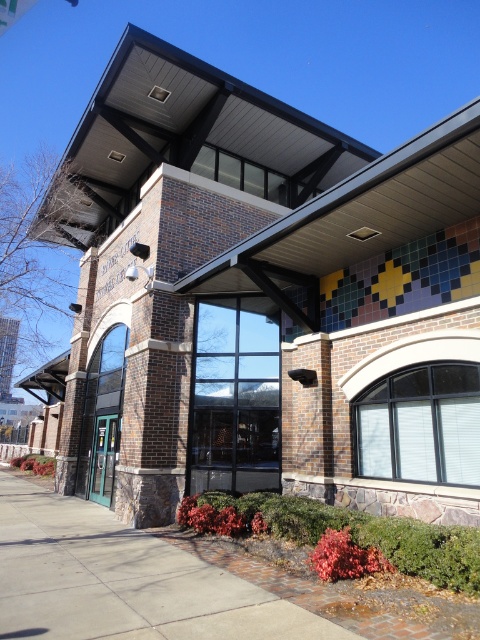
Is gray concrete sidewalk at lower left closer to camera compared to matte glass door at center?

Yes, gray concrete sidewalk at lower left is closer to the viewer.

Measure the distance between gray concrete sidewalk at lower left and camera.

The distance of gray concrete sidewalk at lower left from camera is 12.79 feet.

The height and width of the screenshot is (640, 480). In order to click on gray concrete sidewalk at lower left in this screenshot , I will do `click(123, 580)`.